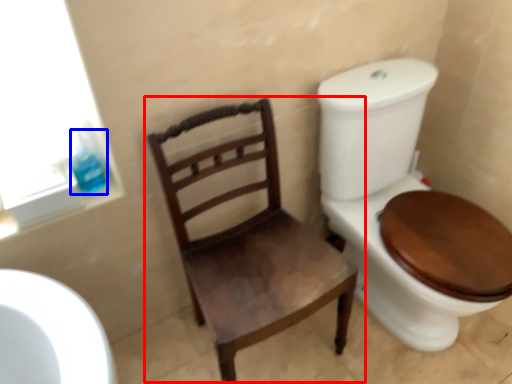
Question: Which of the following is the farthest to the observer, chair (highlighted by a red box) or toilet paper (highlighted by a blue box)?

Choices:
 (A) chair
 (B) toilet paper

Answer: (B)